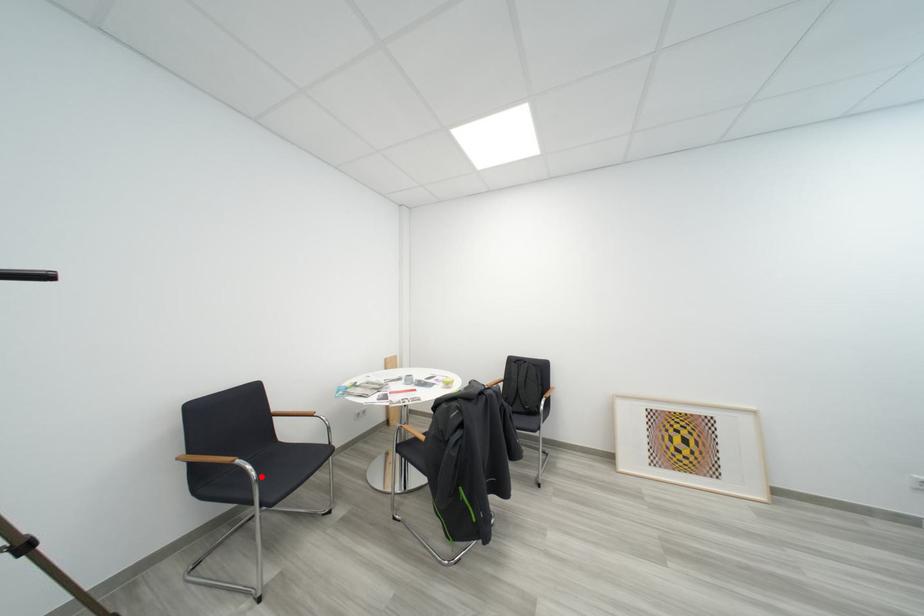
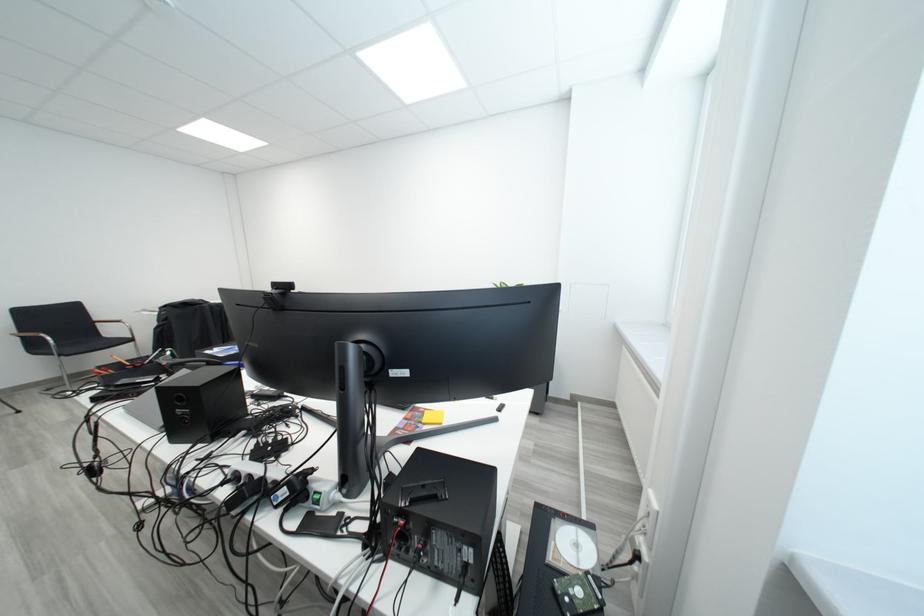
The point at the highlighted location is marked in the first image. Where is the corresponding point in the second image?

(62, 344)